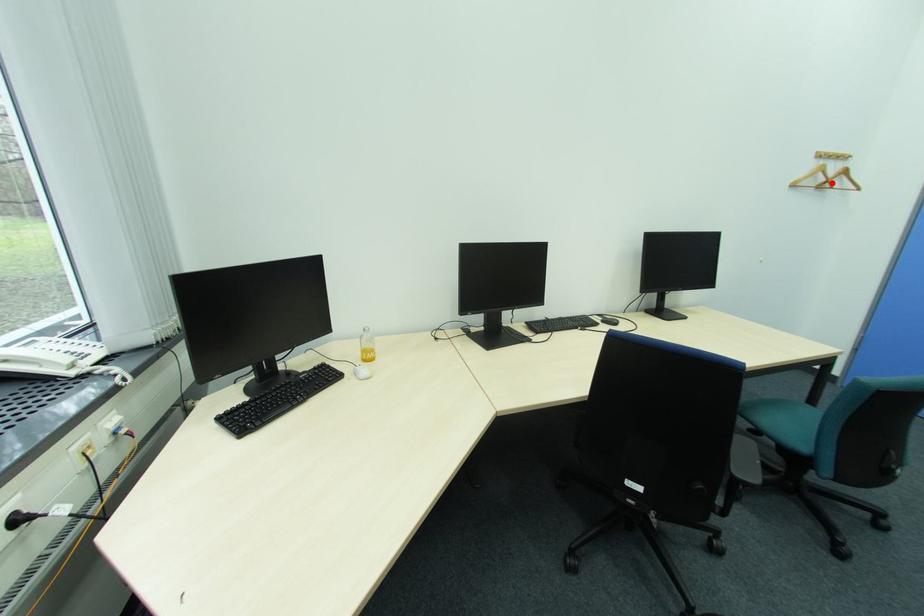
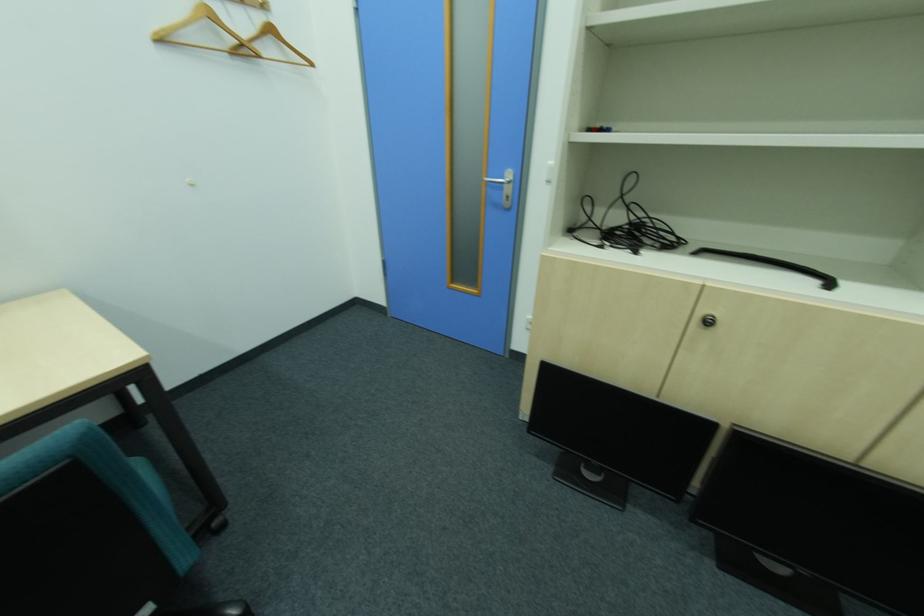
Locate, in the second image, the point that corresponds to the highlighted location in the first image.

(249, 45)